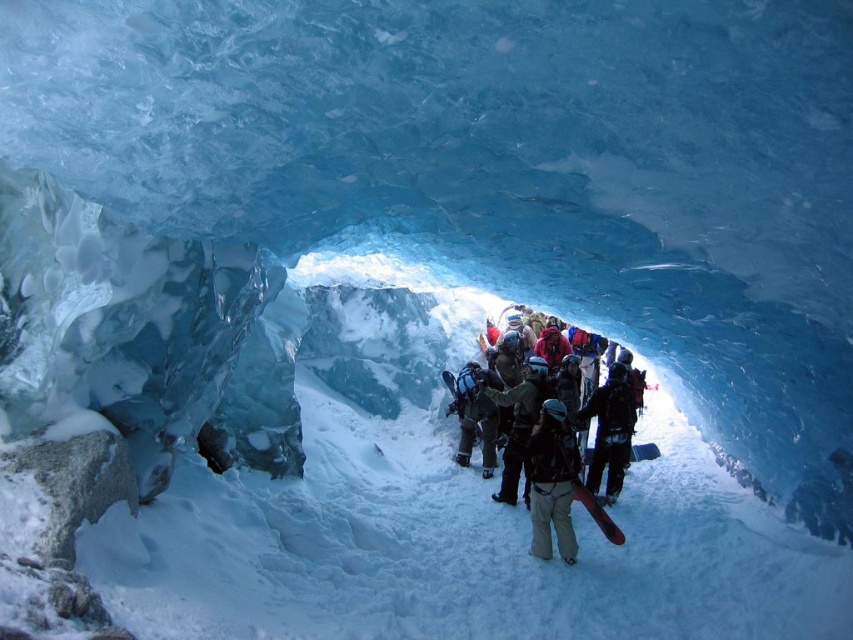
Is matte black jacket at center thinner than dark brown leather jacket at center?

No.

Describe the element at coordinates (544, 460) in the screenshot. I see `matte black jacket at center` at that location.

Is point (518, 465) less distant than point (556, 490)?

No, it is not.

Where is `matte black jacket at center`? matte black jacket at center is located at coordinates (544, 460).